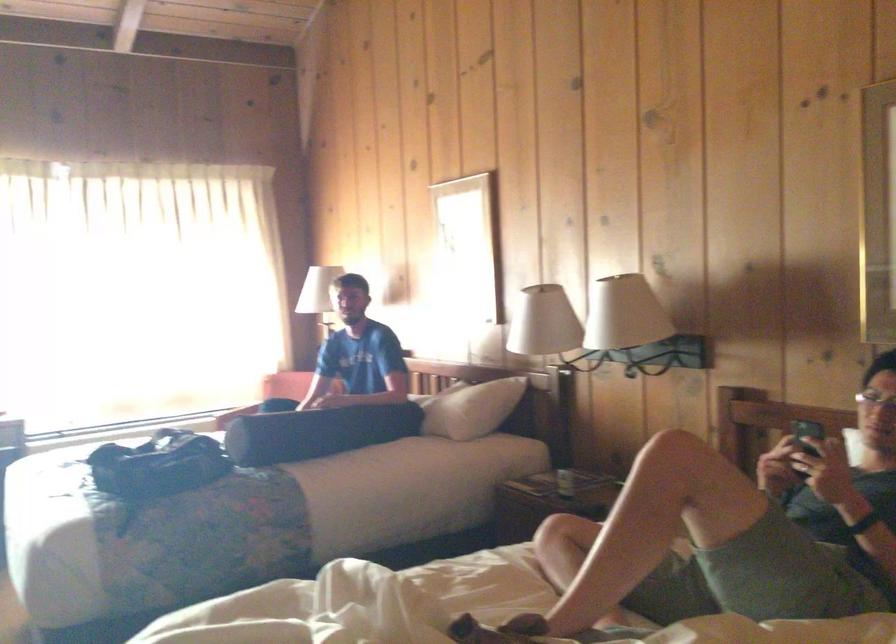
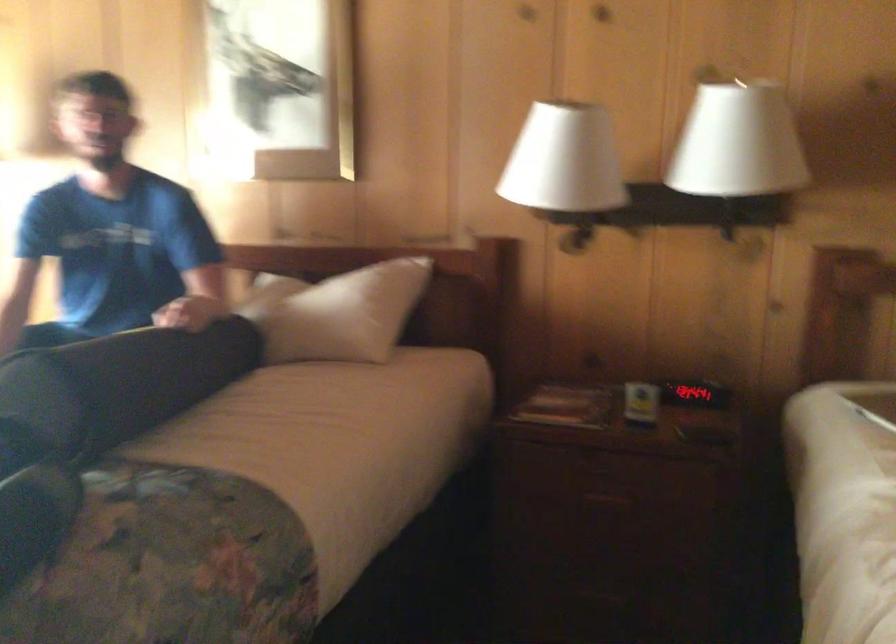
Locate, in the second image, the point that corresponds to the point at 442,404 in the first image.

(340, 313)